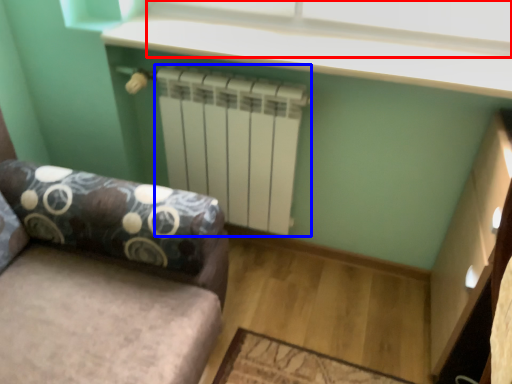
Question: Which of the following is the farthest to the observer, window screen (highlighted by a red box) or radiator (highlighted by a blue box)?

Choices:
 (A) window screen
 (B) radiator

Answer: (B)